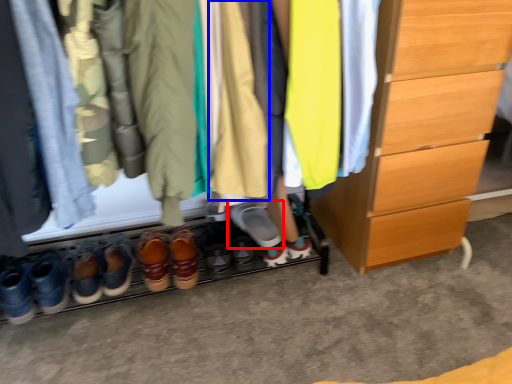
Question: Which object is further to the camera taking this photo, footwear (highlighted by a red box) or clothing (highlighted by a blue box)?

Choices:
 (A) footwear
 (B) clothing

Answer: (A)